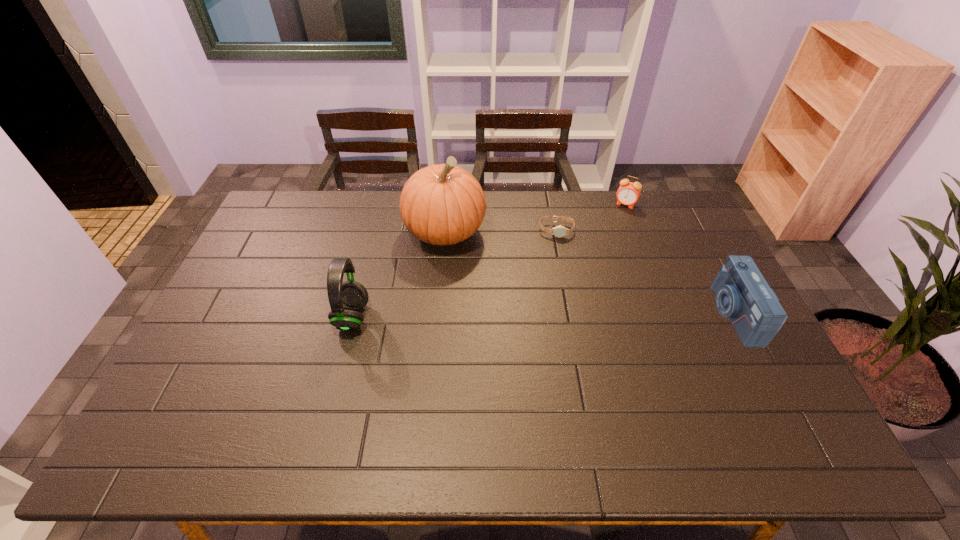
At what (x,y) coordinates should I click in order to perform the action: click on free space that is in between the camera and the leftmost object. Please return your answer as a coordinate pair (x, y). This screenshot has height=540, width=960. Looking at the image, I should click on (542, 315).

Locate an element on the screen. free space between the rightmost object and the third object from right to left is located at coordinates (645, 272).

Locate an element on the screen. free space that is in between the tallest object and the second shortest object is located at coordinates (536, 218).

You are a GUI agent. You are given a task and a screenshot of the screen. Output one action in this format:
    pyautogui.click(x=<x>, y=<y>)
    Task: Click on the object that can be found as the third closest to the rightmost object
    
    Given the screenshot: What is the action you would take?
    pyautogui.click(x=443, y=204)

Select which object is the fourth closest to the third object from right to left. Please provide its 2D coordinates. Your answer should be formatted as a tuple, i.e. [(x, y)], where the tuple contains the x and y coordinates of a point satisfying the conditions above.

[(346, 298)]

Identify the location of vacant point that satisfies the following two spatial constraints: 1. on the back side of the alarm clock; 2. on the right side of the tallest object. The image size is (960, 540). (447, 205).